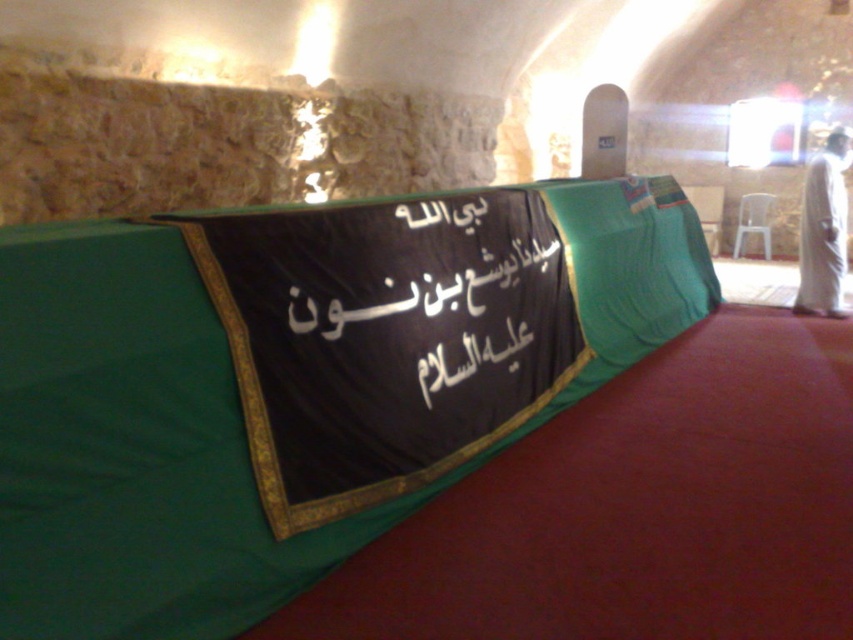
Does green fabric at center have a lesser height compared to white clothed figure at right?

Incorrect, green fabric at center's height does not fall short of white clothed figure at right's.

Which is above, green fabric at center or white clothed figure at right?

Positioned higher is white clothed figure at right.

Locate an element on the screen. green fabric at center is located at coordinates (296, 381).

Who is taller, black fabric text at center or white clothed figure at right?

white clothed figure at right is taller.

Based on the photo, between black fabric text at center and white clothed figure at right, which one has less height?

black fabric text at center

Locate an element on the screen. The image size is (853, 640). black fabric text at center is located at coordinates [x=425, y=304].

How distant is green fabric at center from black fabric text at center?

green fabric at center and black fabric text at center are 7.25 inches apart from each other.

From the picture: Which of these two, green fabric at center or black fabric text at center, stands shorter?

With less height is black fabric text at center.

Is point (45, 476) positioned in front of point (289, 337)?

Yes.

Find the location of `green fabric at center`. green fabric at center is located at coordinates (296, 381).